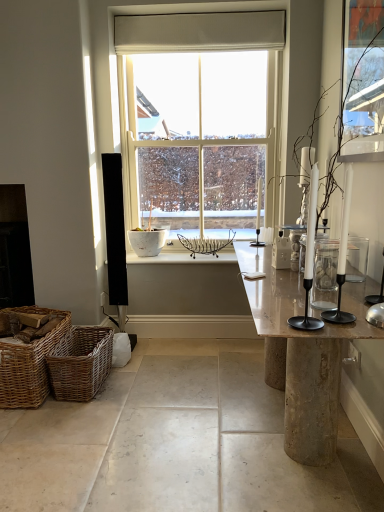
Identify the location of free point above white marble tray at center (from a real-world perspective). (182, 257).